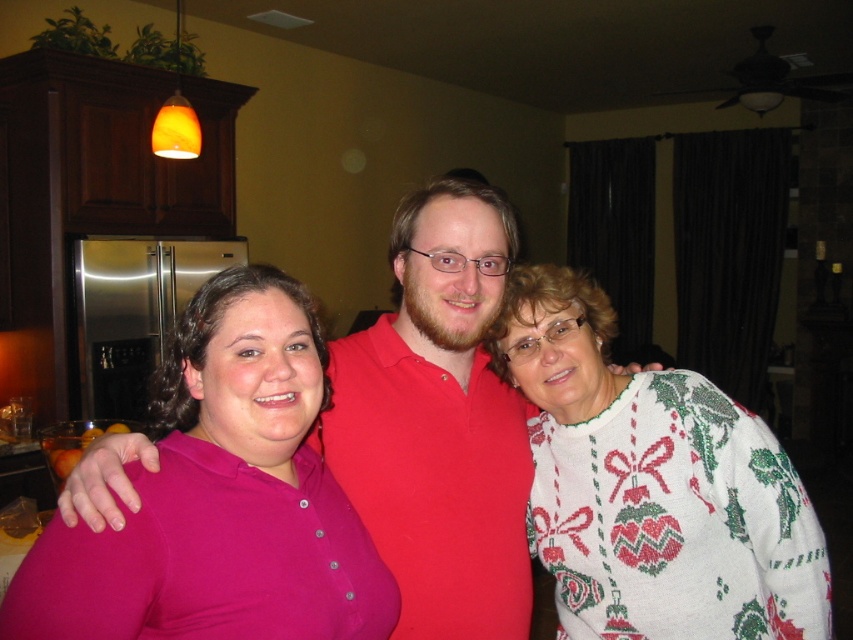
Question: Among these points, which one is farthest from the camera?

Choices:
 (A) (177, 326)
 (B) (383, 323)
 (C) (553, 285)

Answer: (B)

Question: Is white knitted sweater at right positioned behind matte red shirt at center?

Choices:
 (A) no
 (B) yes

Answer: (A)

Question: Can you confirm if matte pink shirt at center is positioned below white knitted sweater at right?

Choices:
 (A) no
 (B) yes

Answer: (A)

Question: Which point is farther to the camera?

Choices:
 (A) (273, 616)
 (B) (630, 552)

Answer: (B)

Question: Which object appears closest to the camera in this image?

Choices:
 (A) white knitted sweater at right
 (B) matte pink shirt at center

Answer: (B)

Question: Is white knitted sweater at right thinner than matte red shirt at center?

Choices:
 (A) no
 (B) yes

Answer: (B)